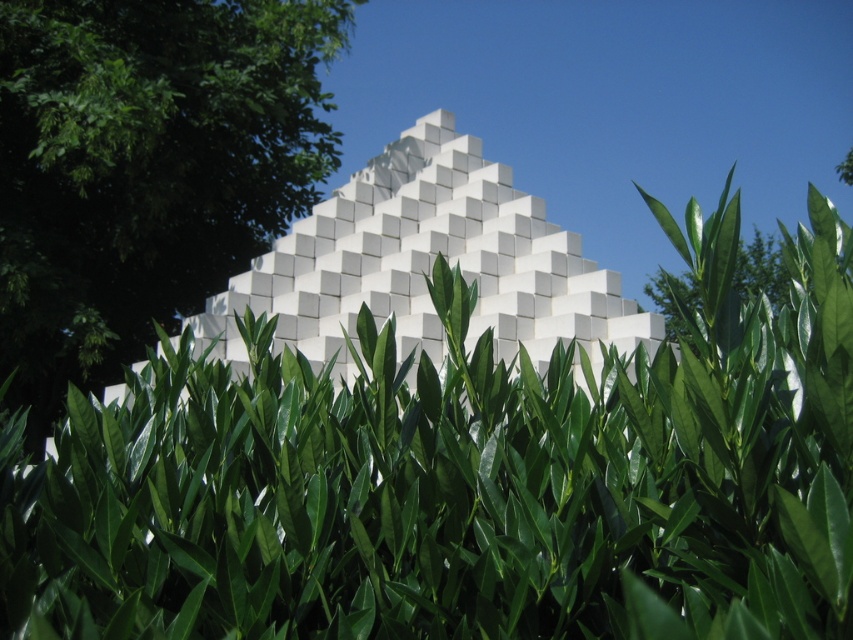
You are an architect planning to install a new sculpture in the pyramid. The sculpture requires a clear space of 2 meters to the right of the white matte cube at center. Is there enough space available? Please consider the green leafy tree at center in your analysis.

The green leafy tree at center is positioned on the left side of white matte cube at center, so there is no obstruction to the right of the white matte cube at center. Therefore, there should be sufficient space for the sculpture as long as the 2 meters to the right is unobstructed by other elements not mentioned here.

You are standing in front of the pyramid structure and notice the green leafy hedge at center. Based on its position, can you determine if the hedge is closer to the base or the peak of the pyramid?

The green leafy hedge at center is located at point (463, 481), which places it closer to the base of the pyramid since the coordinates indicate a lower position relative to the pyramid structure.

You are standing in front of the pyramid and want to get a clear view of its base. The green leafy hedge at center is blocking your view. Can you determine if the hedge is positioned to the left or right of the pyramid?

The green leafy hedge at center is located at point (463,481), which means it is positioned to the right of the pyramid, blocking your view of the base.